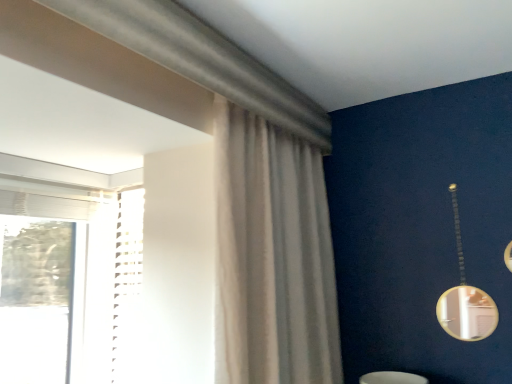
Question: Is point [264, 190] positioned closer to the camera than point [480, 299]?

Choices:
 (A) farther
 (B) closer

Answer: (B)

Question: From a real-world perspective, is sheer white curtain at center physically located above or below gold metallic mirror at right?

Choices:
 (A) above
 (B) below

Answer: (A)

Question: Is sheer white curtain at center bigger or smaller than gold metallic mirror at right?

Choices:
 (A) big
 (B) small

Answer: (A)

Question: Based on their positions, is gold metallic mirror at right located to the left or right of sheer white curtain at center?

Choices:
 (A) left
 (B) right

Answer: (B)

Question: From a real-world perspective, is gold metallic mirror at right positioned above or below sheer white curtain at center?

Choices:
 (A) above
 (B) below

Answer: (B)

Question: Is gold metallic mirror at right bigger or smaller than sheer white curtain at center?

Choices:
 (A) small
 (B) big

Answer: (A)

Question: In terms of height, does gold metallic mirror at right look taller or shorter compared to sheer white curtain at center?

Choices:
 (A) tall
 (B) short

Answer: (B)